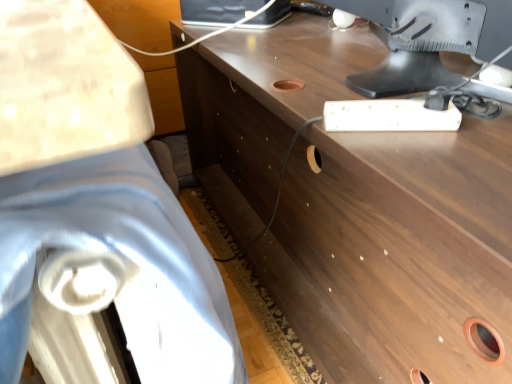
Question: From a real-world perspective, is white fabric swivel chair at left on satin silver monitor at upper right?

Choices:
 (A) yes
 (B) no

Answer: (B)

Question: Can you confirm if white fabric swivel chair at left is shorter than satin silver monitor at upper right?

Choices:
 (A) no
 (B) yes

Answer: (A)

Question: Are white fabric swivel chair at left and satin silver monitor at upper right beside each other?

Choices:
 (A) yes
 (B) no

Answer: (B)

Question: Considering the relative sizes of white fabric swivel chair at left and satin silver monitor at upper right in the image provided, is white fabric swivel chair at left taller than satin silver monitor at upper right?

Choices:
 (A) yes
 (B) no

Answer: (A)

Question: Considering the relative positions of white fabric swivel chair at left and satin silver monitor at upper right in the image provided, is white fabric swivel chair at left behind satin silver monitor at upper right?

Choices:
 (A) no
 (B) yes

Answer: (A)

Question: Could you tell me if white fabric swivel chair at left is facing satin silver monitor at upper right?

Choices:
 (A) yes
 (B) no

Answer: (A)

Question: From the image's perspective, is brown wood desk at center on top of white fabric swivel chair at left?

Choices:
 (A) no
 (B) yes

Answer: (B)

Question: Is brown wood desk at center positioned with its back to white fabric swivel chair at left?

Choices:
 (A) yes
 (B) no

Answer: (A)

Question: Can you confirm if brown wood desk at center is shorter than white fabric swivel chair at left?

Choices:
 (A) yes
 (B) no

Answer: (B)

Question: Does brown wood desk at center come behind white fabric swivel chair at left?

Choices:
 (A) no
 (B) yes

Answer: (B)

Question: Considering the relative sizes of brown wood desk at center and white fabric swivel chair at left in the image provided, is brown wood desk at center wider than white fabric swivel chair at left?

Choices:
 (A) yes
 (B) no

Answer: (A)

Question: From a real-world perspective, is brown wood desk at center physically below white fabric swivel chair at left?

Choices:
 (A) yes
 (B) no

Answer: (A)

Question: Is satin silver monitor at upper right bigger than brown wood desk at center?

Choices:
 (A) no
 (B) yes

Answer: (A)